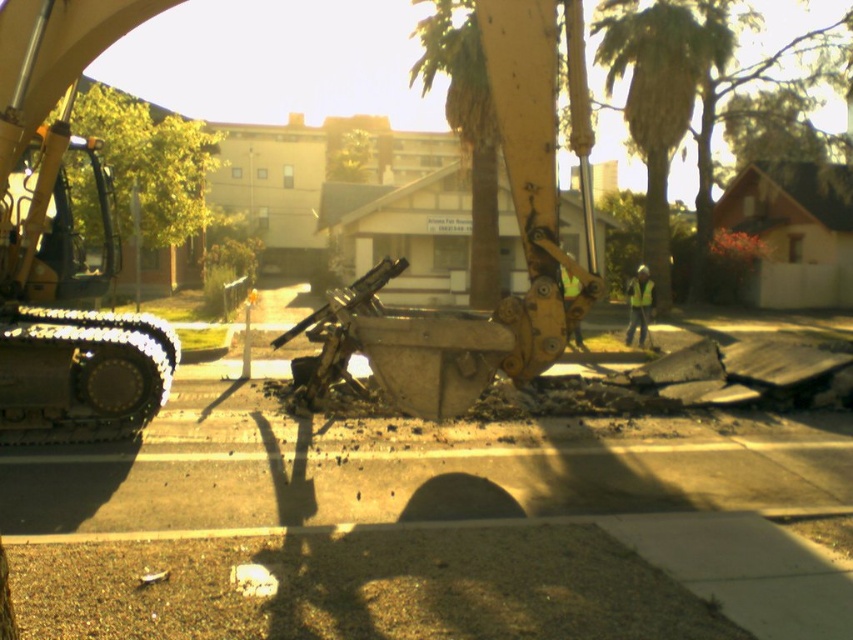
Question: Is yellow metallic excavator at center to the left of green leafy palm tree at upper center from the viewer's perspective?

Choices:
 (A) yes
 (B) no

Answer: (A)

Question: Does yellow metallic excavator at left appear on the right side of yellow reflective vest at center?

Choices:
 (A) no
 (B) yes

Answer: (A)

Question: Estimate the real-world distances between objects in this image. Which object is farther from the yellow metallic excavator at left?

Choices:
 (A) green leafy palm tree at upper center
 (B) yellow metallic excavator at center

Answer: (A)

Question: Which object appears closest to the camera in this image?

Choices:
 (A) yellow reflective vest at center
 (B) yellow metallic excavator at center

Answer: (B)

Question: Which of these objects is positioned farthest from the green leafy palm tree at upper center?

Choices:
 (A) yellow reflective vest at center
 (B) yellow metallic excavator at center

Answer: (B)

Question: Is yellow metallic excavator at left smaller than yellow reflective vest at center?

Choices:
 (A) no
 (B) yes

Answer: (B)